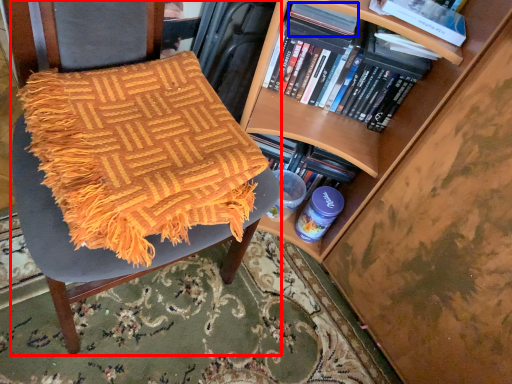
Question: Which point is closer to the camera, chair (highlighted by a red box) or paperback book (highlighted by a blue box)?

Choices:
 (A) chair
 (B) paperback book

Answer: (A)